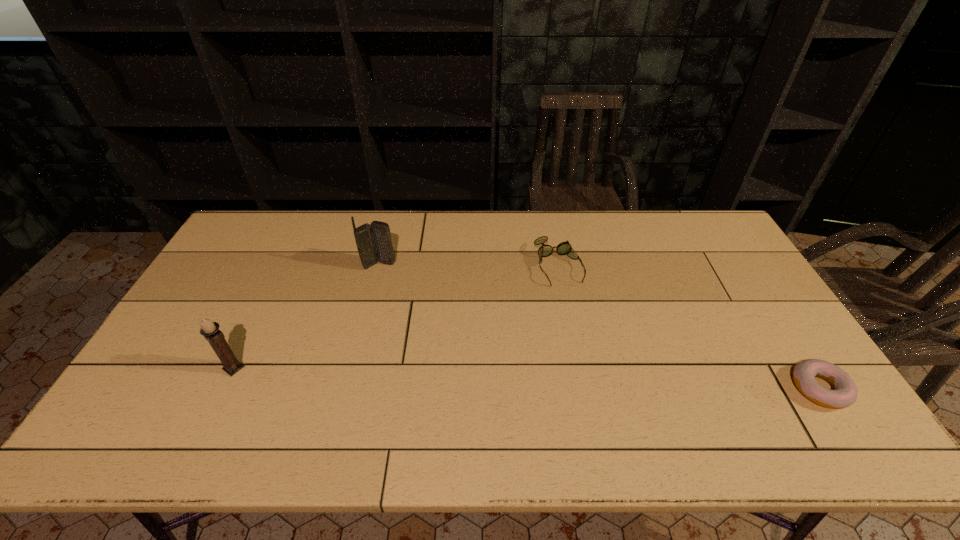
At what (x,y) coordinates should I click in order to perform the action: click on free spot on the desktop that is between the leftmost object and the doughnut and is positioned on the keyboard of the cellular telephone. Please return your answer as a coordinate pair (x, y). Looking at the image, I should click on (524, 378).

Find the location of a particular element. The width and height of the screenshot is (960, 540). vacant space on the desktop that is between the leftmost object and the rightmost object and is positioned on the front-facing side of the spectacles is located at coordinates (609, 381).